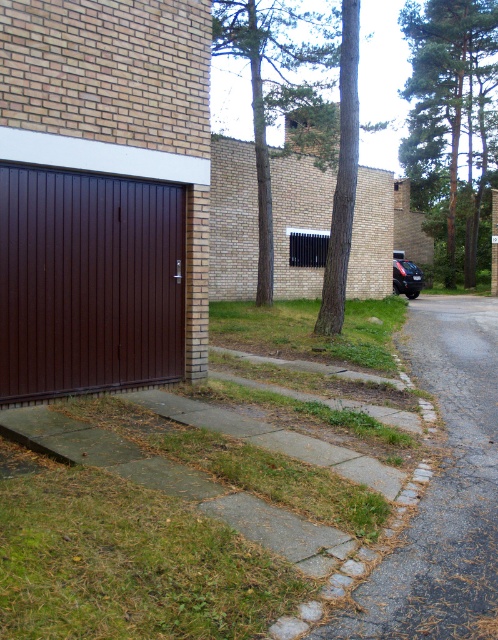
Who is more forward, (468, 188) or (352, 45)?

Point (352, 45) is more forward.

Is point (421, 156) closer to viewer compared to point (348, 209)?

No, it is not.

Locate an element on the screen. green leafy tree at upper right is located at coordinates (451, 109).

Does green leafy tree at upper center appear over green textured tree at center?

Yes, green leafy tree at upper center is above green textured tree at center.

What do you see at coordinates (278, 90) in the screenshot? This screenshot has width=498, height=640. I see `green leafy tree at upper center` at bounding box center [278, 90].

Does point (241, 36) come in front of point (327, 282)?

That is False.

This screenshot has height=640, width=498. I want to click on green leafy tree at upper center, so click(x=278, y=90).

Between green leafy tree at upper center and glossy black car at lower right, which one has less height?

glossy black car at lower right

Can you confirm if green leafy tree at upper center is positioned below glossy black car at lower right?

Incorrect, green leafy tree at upper center is not positioned below glossy black car at lower right.

Is point (218, 4) farther from camera compared to point (396, 292)?

No, (218, 4) is in front of (396, 292).

The height and width of the screenshot is (640, 498). What are the coordinates of `green leafy tree at upper center` in the screenshot? It's located at (278, 90).